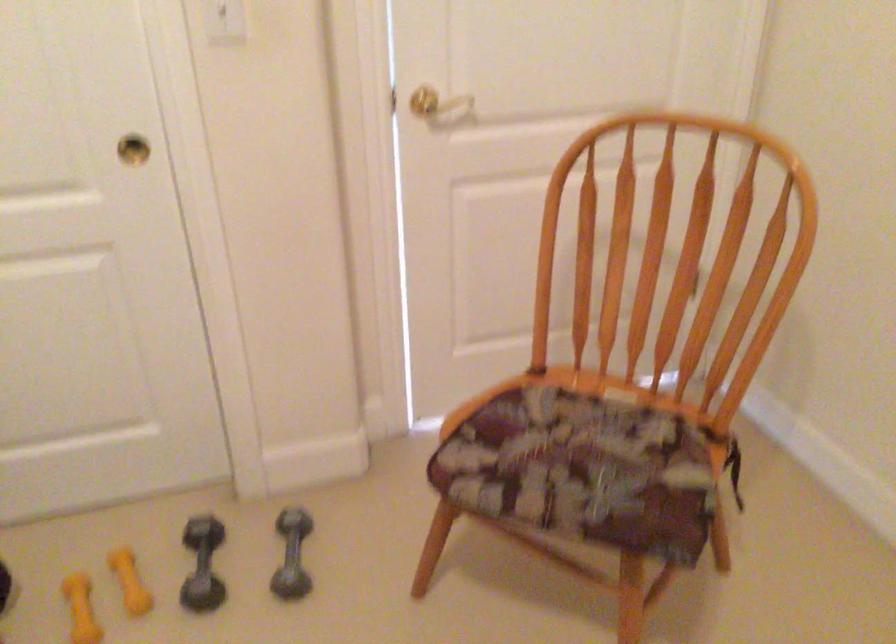
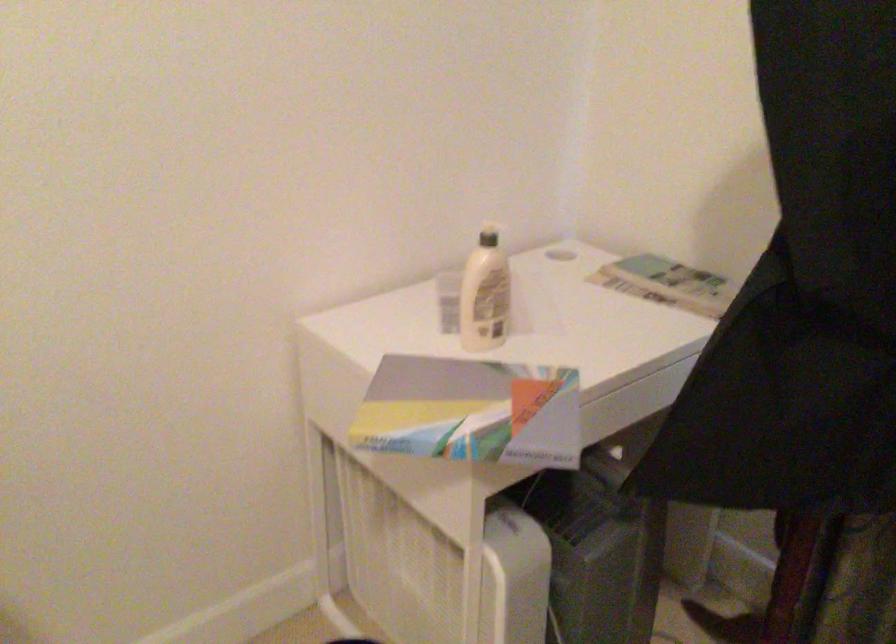
Consider the image. How did the camera likely rotate?

The rotation direction of the camera is right-down.